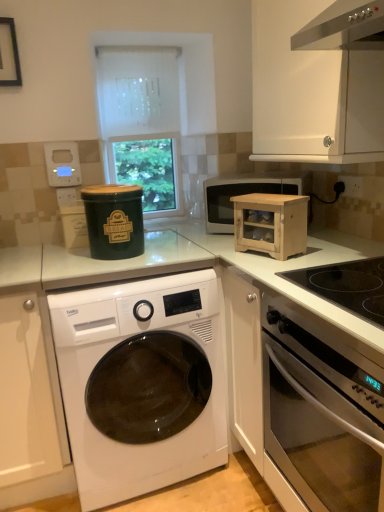
The width and height of the screenshot is (384, 512). I want to click on free spot to the right of natural wood cabinet at right, so click(314, 250).